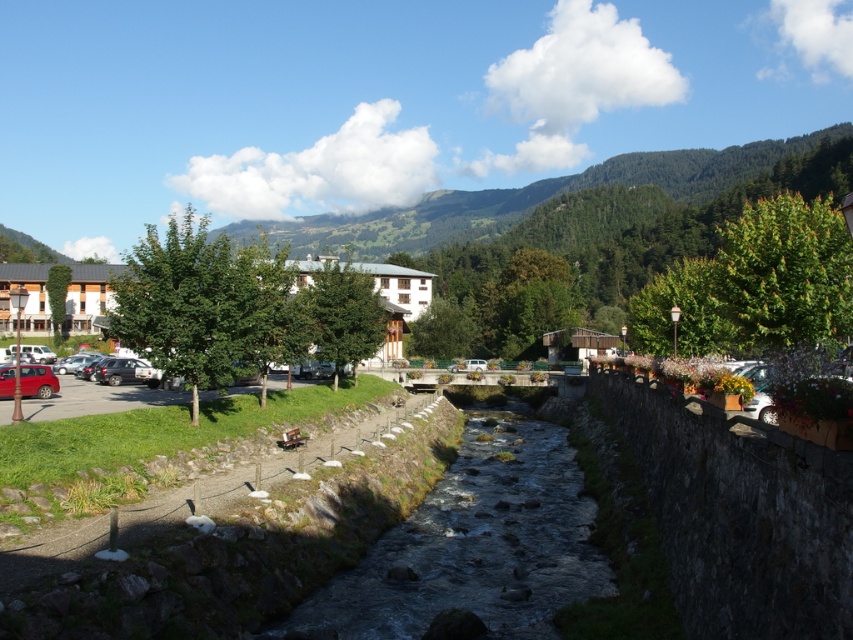
Question: Among these objects, which one is farthest from the camera?

Choices:
 (A) clear water at center
 (B) matte red car at lower left
 (C) wooden hotel at left

Answer: (B)

Question: Which of the following is the farthest from the observer?

Choices:
 (A) wooden hotel at left
 (B) clear water at center

Answer: (A)

Question: Which object appears farthest from the camera in this image?

Choices:
 (A) matte red car at lower left
 (B) wooden hotel at left

Answer: (A)

Question: Does clear water at center have a lesser width compared to matte red car at lower left?

Choices:
 (A) no
 (B) yes

Answer: (A)

Question: Can you confirm if wooden hotel at left is positioned to the right of matte red car at lower left?

Choices:
 (A) yes
 (B) no

Answer: (B)

Question: Does wooden hotel at left have a greater width compared to matte red car at lower left?

Choices:
 (A) no
 (B) yes

Answer: (B)